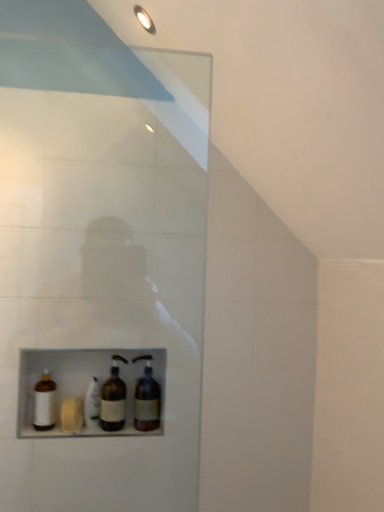
What is the approximate height of brown glass bottle at center, placed as the fourth bottle when sorted from left to right?

It is 11.01 inches.

What is the approximate width of white matte bottle at lower left, which is counted as the 4th bottle, starting from the right?

white matte bottle at lower left, which is counted as the 4th bottle, starting from the right, is 3.61 inches wide.

This screenshot has width=384, height=512. Describe the element at coordinates (44, 402) in the screenshot. I see `white matte bottle at lower left, which is counted as the 4th bottle, starting from the right` at that location.

Image resolution: width=384 pixels, height=512 pixels. What are the coordinates of `brown glass bottle at center, placed as the fourth bottle when sorted from left to right` in the screenshot? It's located at (146, 398).

Which object is wider, brown glass bottle at center, placed as the fourth bottle when sorted from left to right, or white matte bottle at center, the second bottle from the left?

Wider between the two is brown glass bottle at center, placed as the fourth bottle when sorted from left to right.

Between brown glass bottle at center, which ranks as the first bottle in right-to-left order, and white matte bottle at center, acting as the third bottle starting from the right, which one has less height?

Standing shorter between the two is white matte bottle at center, acting as the third bottle starting from the right.

From a real-world perspective, relative to white matte bottle at center, the second bottle from the left, is brown glass bottle at center, which ranks as the first bottle in right-to-left order, vertically above or below?

brown glass bottle at center, which ranks as the first bottle in right-to-left order, is above white matte bottle at center, the second bottle from the left.

Is white matte bottle at center, acting as the third bottle starting from the right, inside or outside of brown glass bottle at center, which is counted as the third bottle, starting from the left?

white matte bottle at center, acting as the third bottle starting from the right, is outside brown glass bottle at center, which is counted as the third bottle, starting from the left.

Which is in front, point (94, 399) or point (119, 396)?

Point (94, 399)

From a real-world perspective, is white matte bottle at center, acting as the third bottle starting from the right, over brown glass bottle at center, which is counted as the third bottle, starting from the left?

No, from a real-world perspective, white matte bottle at center, acting as the third bottle starting from the right, is not on top of brown glass bottle at center, which is counted as the third bottle, starting from the left.

How different are the orientations of white matte bottle at center, the second bottle from the left, and brown glass bottle at center, which is counted as the third bottle, starting from the left, in degrees?

0.514 degrees separate the facing orientations of white matte bottle at center, the second bottle from the left, and brown glass bottle at center, which is counted as the third bottle, starting from the left.

From the picture: Is white matte bottle at lower left, which is counted as the 4th bottle, starting from the right, not near white matte bottle at center, the second bottle from the left?

No.

Do you think white matte bottle at lower left, marked as the first bottle in a left-to-right arrangement, is within white matte bottle at center, the second bottle from the left, or outside of it?

white matte bottle at lower left, marked as the first bottle in a left-to-right arrangement, is outside white matte bottle at center, the second bottle from the left.

Consider the image. Is white matte bottle at lower left, marked as the first bottle in a left-to-right arrangement, thinner than white matte bottle at center, acting as the third bottle starting from the right?

Yes.

Which is nearer, [46,416] or [94,413]?

The point [46,416] is more forward.

Looking at this image, how distant is brown glass bottle at center, which ranks as the first bottle in right-to-left order, from brown glass bottle at center, which is counted as the third bottle, starting from the left?

brown glass bottle at center, which ranks as the first bottle in right-to-left order, and brown glass bottle at center, which is counted as the third bottle, starting from the left, are 9.41 centimeters apart from each other.

Can you confirm if brown glass bottle at center, which ranks as the first bottle in right-to-left order, is positioned to the right of brown glass bottle at center, which is counted as the third bottle, starting from the left?

Yes.

Can you confirm if brown glass bottle at center, which ranks as the first bottle in right-to-left order, is bigger than brown glass bottle at center, which appears as the second bottle when viewed from the right?

Yes.

Looking at this image, from a real-world perspective, is brown glass bottle at center, placed as the fourth bottle when sorted from left to right, physically below brown glass bottle at center, which appears as the second bottle when viewed from the right?

No, from a real-world perspective, brown glass bottle at center, placed as the fourth bottle when sorted from left to right, is not beneath brown glass bottle at center, which appears as the second bottle when viewed from the right.

Would you say brown glass bottle at center, which ranks as the first bottle in right-to-left order, is a long distance from white matte bottle at lower left, marked as the first bottle in a left-to-right arrangement?

brown glass bottle at center, which ranks as the first bottle in right-to-left order, is actually quite close to white matte bottle at lower left, marked as the first bottle in a left-to-right arrangement.

Does brown glass bottle at center, which ranks as the first bottle in right-to-left order, have a greater height compared to white matte bottle at lower left, marked as the first bottle in a left-to-right arrangement?

Indeed, brown glass bottle at center, which ranks as the first bottle in right-to-left order, has a greater height compared to white matte bottle at lower left, marked as the first bottle in a left-to-right arrangement.

In the scene shown: Is brown glass bottle at center, which ranks as the first bottle in right-to-left order, closer to the viewer compared to white matte bottle at lower left, marked as the first bottle in a left-to-right arrangement?

No, brown glass bottle at center, which ranks as the first bottle in right-to-left order, is further to the viewer.

Where is `the 2nd bottle directly above the white matte bottle at lower left, which is counted as the 4th bottle, starting from the right (from a real-world perspective)`? the 2nd bottle directly above the white matte bottle at lower left, which is counted as the 4th bottle, starting from the right (from a real-world perspective) is located at coordinates (146, 398).

Locate an element on the screen. The image size is (384, 512). the 3rd bottle located above the white matte bottle at center, acting as the third bottle starting from the right (from a real-world perspective) is located at coordinates (146, 398).

Who is shorter, white matte bottle at center, the second bottle from the left, or brown glass bottle at center, placed as the fourth bottle when sorted from left to right?

white matte bottle at center, the second bottle from the left, is shorter.

Between white matte bottle at center, the second bottle from the left, and brown glass bottle at center, placed as the fourth bottle when sorted from left to right, which one has smaller width?

white matte bottle at center, the second bottle from the left.

Does point (90, 403) appear closer or farther from the camera than point (144, 420)?

Point (90, 403).

Is white matte bottle at lower left, marked as the first bottle in a left-to-right arrangement, bigger than brown glass bottle at center, placed as the fourth bottle when sorted from left to right?

No.

Which object is positioned more to the right, white matte bottle at lower left, marked as the first bottle in a left-to-right arrangement, or brown glass bottle at center, which ranks as the first bottle in right-to-left order?

Positioned to the right is brown glass bottle at center, which ranks as the first bottle in right-to-left order.

This screenshot has height=512, width=384. Find the location of `the 3rd bottle counting from the left side of the brown glass bottle at center, placed as the fourth bottle when sorted from left to right`. the 3rd bottle counting from the left side of the brown glass bottle at center, placed as the fourth bottle when sorted from left to right is located at coordinates (44, 402).

In the scene shown: From a real-world perspective, is white matte bottle at lower left, marked as the first bottle in a left-to-right arrangement, below brown glass bottle at center, placed as the fourth bottle when sorted from left to right?

Indeed, from a real-world perspective, white matte bottle at lower left, marked as the first bottle in a left-to-right arrangement, is positioned beneath brown glass bottle at center, placed as the fourth bottle when sorted from left to right.

Locate an element on the screen. the 3rd bottle below the brown glass bottle at center, which ranks as the first bottle in right-to-left order (from a real-world perspective) is located at coordinates (92, 403).

The width and height of the screenshot is (384, 512). What are the coordinates of `the 1st bottle counting from the right of the white matte bottle at center, acting as the third bottle starting from the right` in the screenshot? It's located at (113, 399).

Estimate the real-world distances between objects in this image. Which object is closer to white matte bottle at lower left, marked as the first bottle in a left-to-right arrangement, brown glass bottle at center, which ranks as the first bottle in right-to-left order, or white matte bottle at center, the second bottle from the left?

white matte bottle at center, the second bottle from the left.

Based on their spatial positions, is white matte bottle at center, the second bottle from the left, or brown glass bottle at center, which is counted as the third bottle, starting from the left, further from brown glass bottle at center, placed as the fourth bottle when sorted from left to right?

The object further to brown glass bottle at center, placed as the fourth bottle when sorted from left to right, is white matte bottle at center, the second bottle from the left.

Which object lies nearer to the anchor point white matte bottle at center, the second bottle from the left, brown glass bottle at center, which appears as the second bottle when viewed from the right, or brown glass bottle at center, placed as the fourth bottle when sorted from left to right?

brown glass bottle at center, which appears as the second bottle when viewed from the right, is positioned closer to the anchor white matte bottle at center, the second bottle from the left.

When comparing their distances from white matte bottle at lower left, marked as the first bottle in a left-to-right arrangement, does brown glass bottle at center, which is counted as the third bottle, starting from the left, or white matte bottle at center, the second bottle from the left, seem closer?

Based on the image, white matte bottle at center, the second bottle from the left, appears to be nearer to white matte bottle at lower left, marked as the first bottle in a left-to-right arrangement.

Estimate the real-world distances between objects in this image. Which object is further from white matte bottle at lower left, marked as the first bottle in a left-to-right arrangement, white matte bottle at center, the second bottle from the left, or brown glass bottle at center, placed as the fourth bottle when sorted from left to right?

brown glass bottle at center, placed as the fourth bottle when sorted from left to right, lies further to white matte bottle at lower left, marked as the first bottle in a left-to-right arrangement, than the other object.

Looking at the image, which one is located further to brown glass bottle at center, placed as the fourth bottle when sorted from left to right, white matte bottle at center, the second bottle from the left, or white matte bottle at lower left, marked as the first bottle in a left-to-right arrangement?

Among the two, white matte bottle at lower left, marked as the first bottle in a left-to-right arrangement, is located further to brown glass bottle at center, placed as the fourth bottle when sorted from left to right.

Looking at the image, which one is located closer to brown glass bottle at center, which is counted as the third bottle, starting from the left, white matte bottle at lower left, marked as the first bottle in a left-to-right arrangement, or white matte bottle at center, acting as the third bottle starting from the right?

The object closer to brown glass bottle at center, which is counted as the third bottle, starting from the left, is white matte bottle at center, acting as the third bottle starting from the right.

From the image, which object appears to be farther from brown glass bottle at center, which ranks as the first bottle in right-to-left order, white matte bottle at lower left, marked as the first bottle in a left-to-right arrangement, or white matte bottle at center, the second bottle from the left?

white matte bottle at lower left, marked as the first bottle in a left-to-right arrangement, is positioned further to the anchor brown glass bottle at center, which ranks as the first bottle in right-to-left order.

This screenshot has height=512, width=384. In order to click on bottle between white matte bottle at center, the second bottle from the left, and brown glass bottle at center, placed as the fourth bottle when sorted from left to right, in the horizontal direction in this screenshot , I will do `click(113, 399)`.

Identify the location of bottle between white matte bottle at lower left, marked as the first bottle in a left-to-right arrangement, and brown glass bottle at center, which is counted as the third bottle, starting from the left, in the horizontal direction. (92, 403).